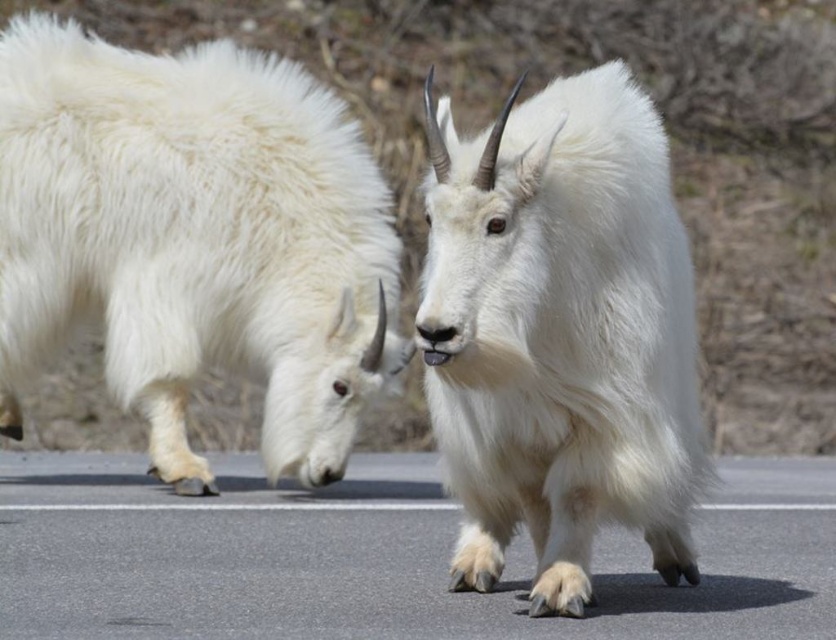
Which is behind, point (261, 58) or point (620, 260)?

Positioned behind is point (261, 58).

What do you see at coordinates (194, 240) in the screenshot? The width and height of the screenshot is (836, 640). I see `white fluffy goat at left` at bounding box center [194, 240].

The image size is (836, 640). Find the location of `white fluffy goat at left`. white fluffy goat at left is located at coordinates tap(194, 240).